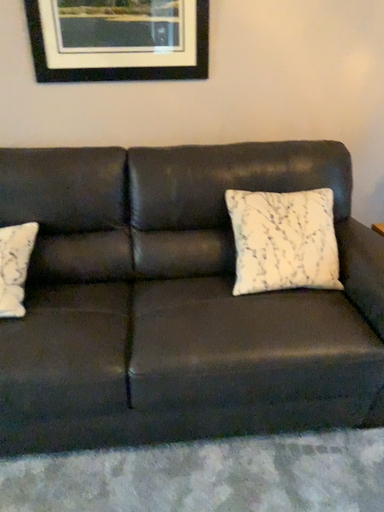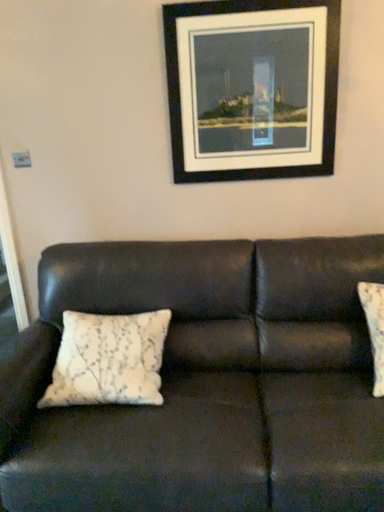
Question: How did the camera likely rotate when shooting the video?

Choices:
 (A) rotated left
 (B) rotated right

Answer: (A)